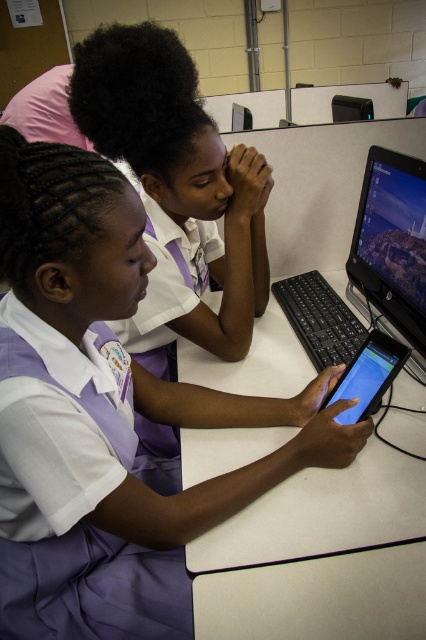
You are a student in a classroom and need to locate your school uniform. According to the image, where exactly is the purple fabric school uniform at lower left located?

The purple fabric school uniform at lower left is located at point (x=86, y=582).

Looking at this image, you are standing at the entrance of the classroom and want to place a new desk in the same location as the white plastic table at center. What are the coordinates where you should place the new desk?

The white plastic table at center is located at point (x=319, y=556), so you should place the new desk at those coordinates.

You are a teacher observing a classroom scene. You notice a white plastic table at center and a purple fabric school uniform at lower left. Which object takes up more space in the image?

The white plastic table at center is larger in size than the purple fabric school uniform at lower left, so it takes up more space in the image.